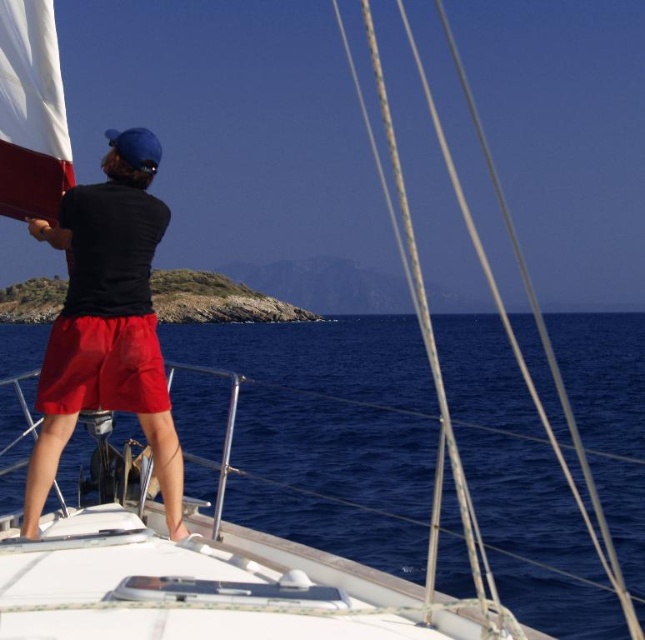
Question: Among these points, which one is nearest to the camera?

Choices:
 (A) (61, 406)
 (B) (34, 228)
 (C) (10, 188)

Answer: (A)

Question: Which point is farther to the camera?

Choices:
 (A) (141, 396)
 (B) (21, 67)
 (C) (161, 358)

Answer: (C)

Question: Which of these objects is positioned farthest from the black matte shirt at center?

Choices:
 (A) white matte sail at upper left
 (B) matte red shorts at center

Answer: (A)

Question: Is black matte shirt at center in front of white matte sail at upper left?

Choices:
 (A) yes
 (B) no

Answer: (A)

Question: Does black matte shirt at center have a lesser width compared to matte red shorts at center?

Choices:
 (A) yes
 (B) no

Answer: (B)

Question: Is black matte shirt at center smaller than matte red shorts at center?

Choices:
 (A) no
 (B) yes

Answer: (A)